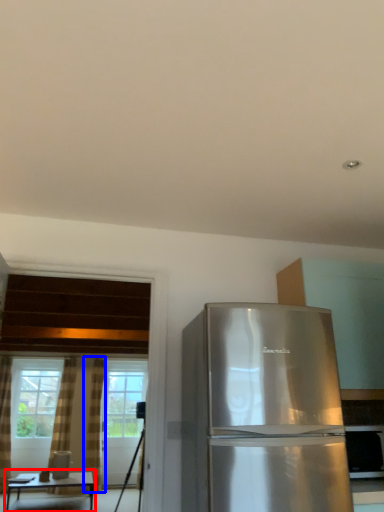
Question: Which object appears closest to the camera in this image, table (highlighted by a red box) or curtain (highlighted by a blue box)?

Choices:
 (A) table
 (B) curtain

Answer: (A)